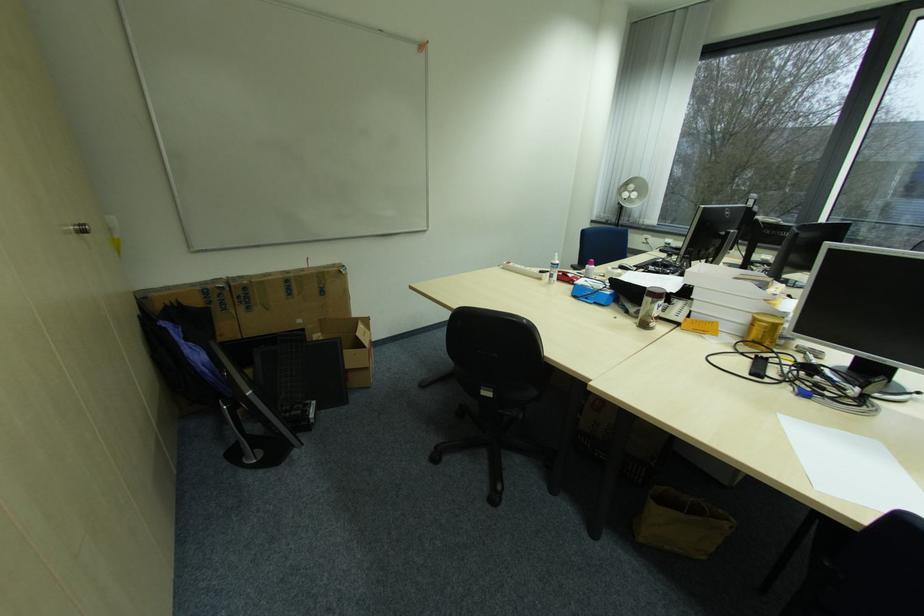
Locate an element on the screen. The image size is (924, 616). pink cap bottle is located at coordinates (590, 269).